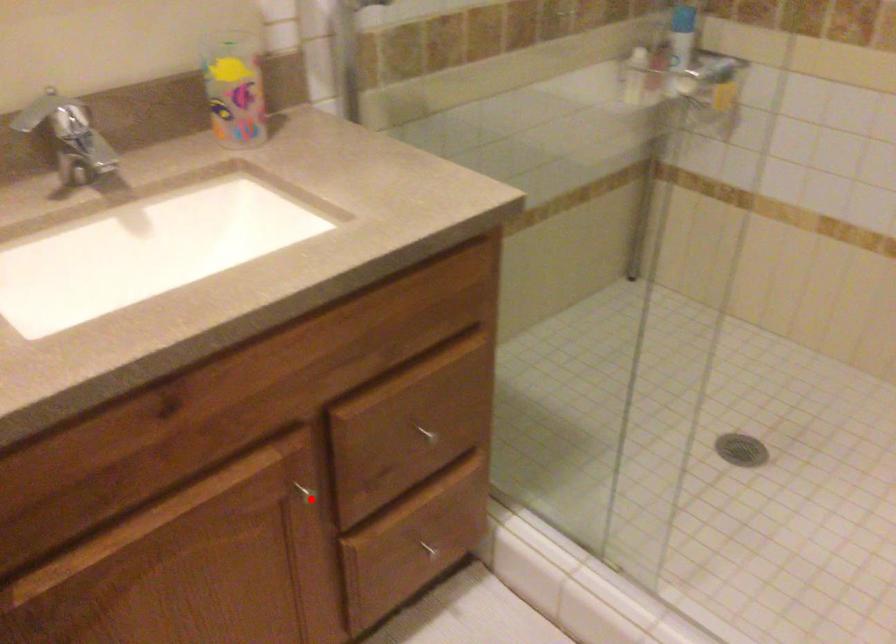
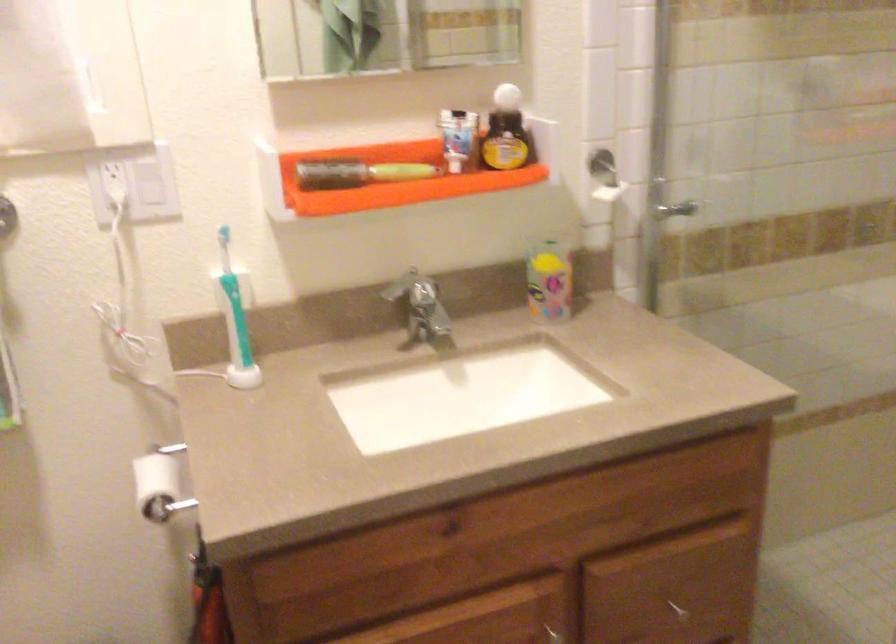
Locate, in the second image, the point that corresponds to the highlighted location in the first image.

(555, 635)